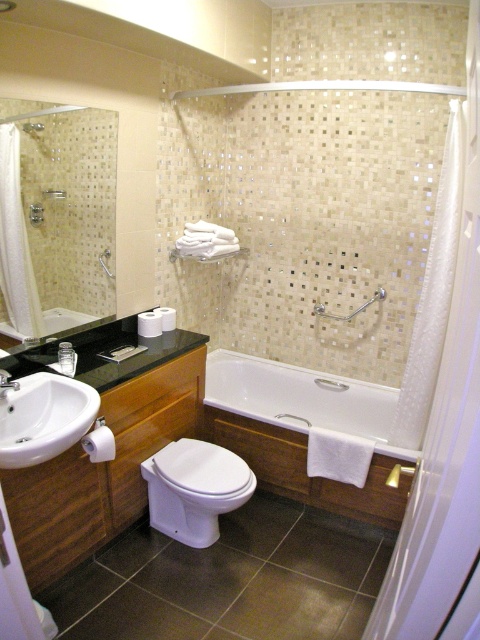
You are a delivery person with a package that is 5 feet long. You need to move it through the bathroom from the white glossy bathtub at center to the white translucent screen door at right. Can the package fit through the space between them?

The distance between the white translucent screen door at right and the white glossy bathtub at center is 5.63 feet. Since the package is 5 feet long, it can fit through the space as it is slightly longer than the package.

You are a plumber inspecting the bathroom and need to locate the shower and faucet. According to the image, where is the matte silver shower at upper center in relation to the brushed metal faucet at sink left?

The matte silver shower at upper center is above the brushed metal faucet at sink left.